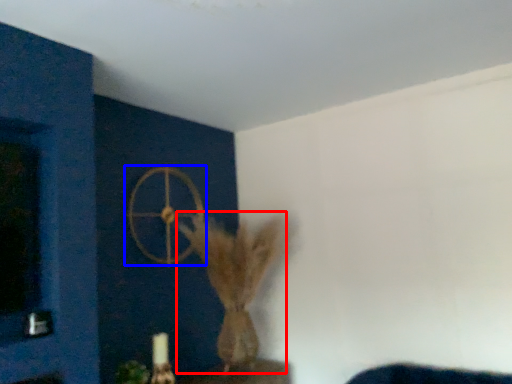
Question: Which point is closer to the camera, animal (highlighted by a red box) or wheel (highlighted by a blue box)?

Choices:
 (A) animal
 (B) wheel

Answer: (A)